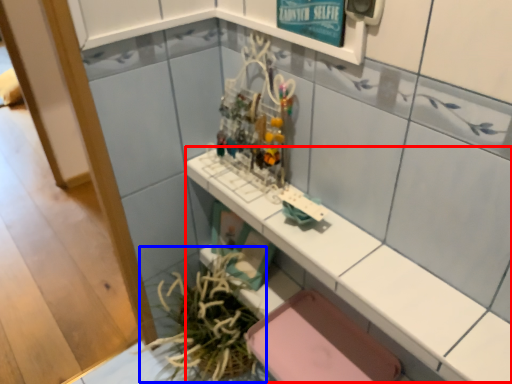
Question: Which of the following is the closest to the observer, counter top (highlighted by a red box) or plant (highlighted by a blue box)?

Choices:
 (A) counter top
 (B) plant

Answer: (A)